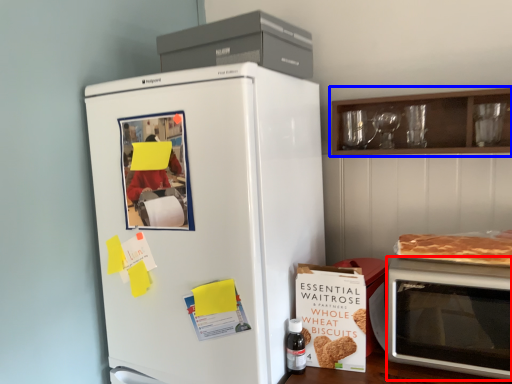
Question: Which object appears farthest to the camera in this image, microwave oven (highlighted by a red box) or cabinetry (highlighted by a blue box)?

Choices:
 (A) microwave oven
 (B) cabinetry

Answer: (B)